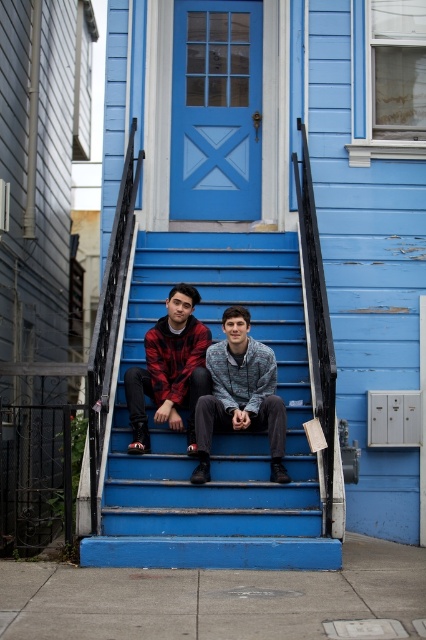
Does blue matte stairs at center appear over plaid fabric shirt at center?

Correct, blue matte stairs at center is located above plaid fabric shirt at center.

Does blue matte stairs at center appear under plaid fabric shirt at center?

No.

Find the location of `blue matte stairs at center`. blue matte stairs at center is located at coordinates (216, 435).

Can you confirm if plaid fabric shirt at center is taller than red plaid shirt at center?

Indeed, plaid fabric shirt at center has a greater height compared to red plaid shirt at center.

Does plaid fabric shirt at center have a smaller size compared to red plaid shirt at center?

Actually, plaid fabric shirt at center might be larger than red plaid shirt at center.

Describe the element at coordinates (195, 390) in the screenshot. I see `plaid fabric shirt at center` at that location.

Where is `plaid fabric shirt at center`? plaid fabric shirt at center is located at coordinates (195, 390).

Who is lower down, blue matte stairs at center or red plaid shirt at center?

red plaid shirt at center

Can you confirm if blue matte stairs at center is positioned above red plaid shirt at center?

Correct, blue matte stairs at center is located above red plaid shirt at center.

Is point (282, 532) behind point (184, 376)?

No, it is in front of (184, 376).

At what (x,y) coordinates should I click in order to perform the action: click on blue matte stairs at center. Please return your answer as a coordinate pair (x, y). Looking at the image, I should click on (216, 435).